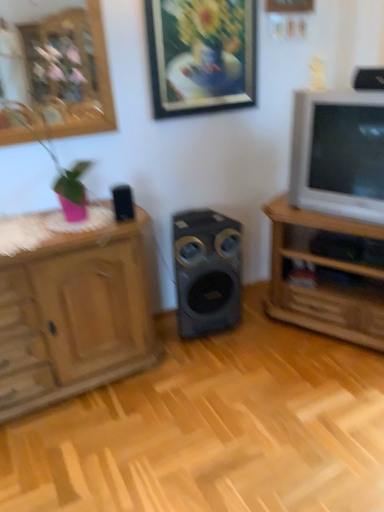
Find the location of a particular element. free area in between matte black speaker at center, acting as the second speaker starting from the right, and wooden cabinet at left is located at coordinates (179, 340).